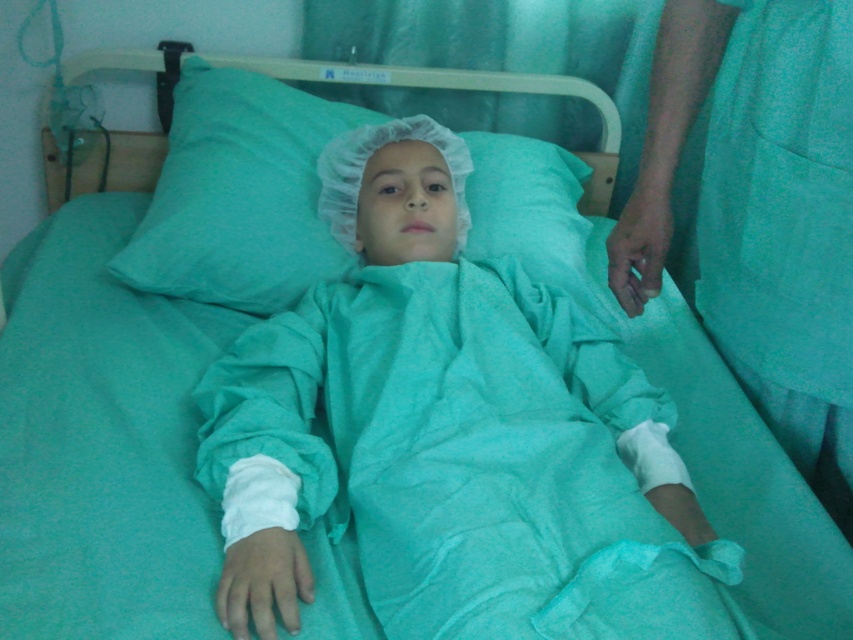
Question: Which object is positioned farthest from the teal fabric gown at center?

Choices:
 (A) green fabric at right
 (B) teal fabric pillow at center

Answer: (A)

Question: Does teal fabric gown at center have a greater width compared to green fabric at right?

Choices:
 (A) yes
 (B) no

Answer: (A)

Question: In this image, where is teal fabric gown at center located relative to teal fabric pillow at center?

Choices:
 (A) above
 (B) below

Answer: (B)

Question: Which of these objects is positioned farthest from the green fabric at right?

Choices:
 (A) teal fabric gown at center
 (B) teal fabric pillow at center

Answer: (B)

Question: Which point is closer to the camera taking this photo?

Choices:
 (A) (747, 355)
 (B) (283, 243)
 (C) (488, 321)

Answer: (A)

Question: Does green fabric at right have a greater width compared to teal fabric pillow at center?

Choices:
 (A) yes
 (B) no

Answer: (B)